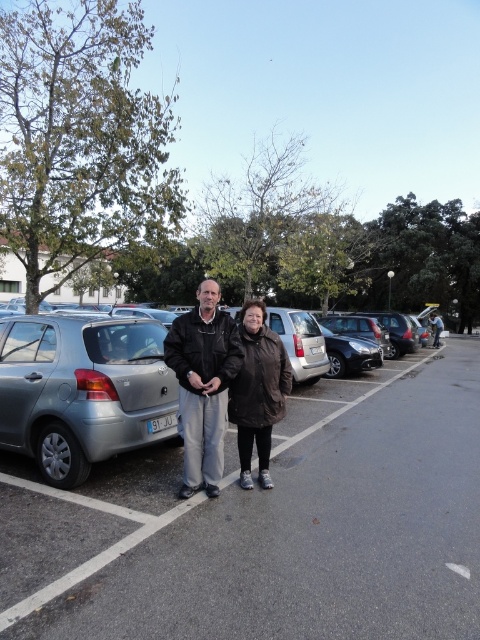
Between silver metallic hatchback at center and black leather jacket at center, which one has more height?

Standing taller between the two is black leather jacket at center.

Between silver metallic hatchback at center and black leather jacket at center, which one appears on the left side from the viewer's perspective?

Positioned to the left is black leather jacket at center.

What do you see at coordinates (97, 410) in the screenshot? The height and width of the screenshot is (640, 480). I see `silver metallic hatchback at center` at bounding box center [97, 410].

Find the location of a particular element. The width and height of the screenshot is (480, 640). silver metallic hatchback at center is located at coordinates (97, 410).

Does silver metallic car at center have a greater height compared to dark brown leather jacket at center?

In fact, silver metallic car at center may be shorter than dark brown leather jacket at center.

Looking at this image, does silver metallic car at center appear on the left side of dark brown leather jacket at center?

Incorrect, silver metallic car at center is not on the left side of dark brown leather jacket at center.

Which is in front, point (428, 516) or point (254, 356)?

Point (428, 516) is more forward.

Locate an element on the screen. The image size is (480, 640). silver metallic car at center is located at coordinates [x=268, y=525].

Can you confirm if silver metallic car at center is taller than black leather jacket at center?

In fact, silver metallic car at center may be shorter than black leather jacket at center.

The image size is (480, 640). Find the location of `silver metallic car at center`. silver metallic car at center is located at coordinates (268, 525).